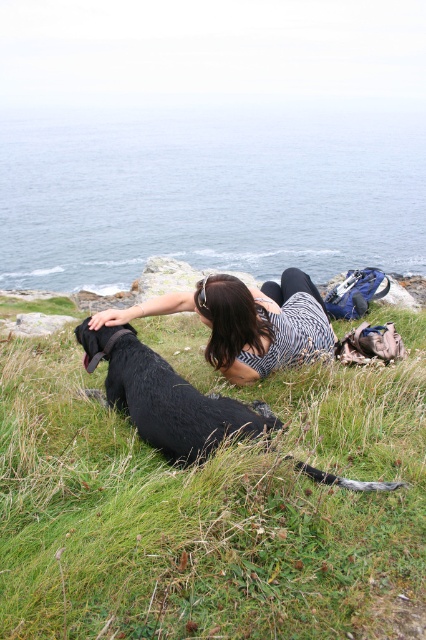
You are a photographer trying to capture a clear shot of the shiny black dog at center. The green grassy at center is blocking part of the dog. How can you adjust your position to get a better view?

Since the green grassy at center is much taller than the shiny black dog at center, you should move to a higher elevation to look down on the dog, ensuring the grass doesn

You are a hiker who wants to place a picnic basket on the green grassy at center without disturbing the shiny black dog at center. Based on the scene description, where should you place it?

The green grassy at center is positioned under the shiny black dog at center, so you should place the picnic basket on the green grassy at center away from the area where the dog is lying to avoid disturbing it.